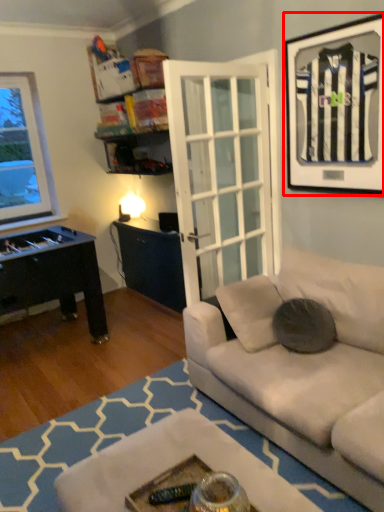
Question: From the image's perspective, where is picture frame (annotated by the red box) located relative to pillow?

Choices:
 (A) above
 (B) below

Answer: (A)